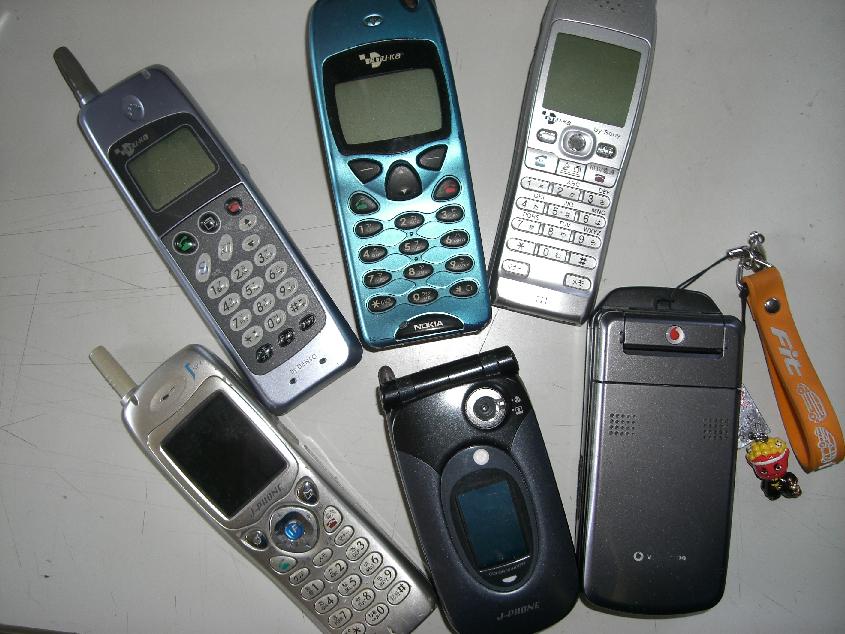
Where is `phones`? phones is located at coordinates (281, 486), (264, 307), (378, 223), (538, 160), (657, 398), (502, 450).